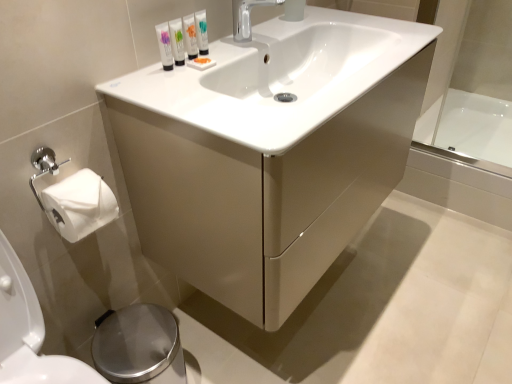
Image resolution: width=512 pixels, height=384 pixels. What are the coordinates of `vacant space behind chrome metallic faucet at center` in the screenshot? It's located at pyautogui.click(x=270, y=34).